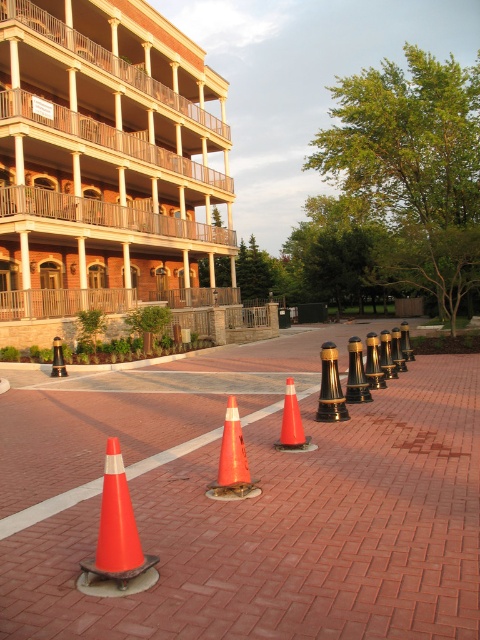
You are standing at the point with coordinates (48, 508) in the image. What object are you standing on?

You are standing on the orange reflective cone at center because the point (48, 508) is located on it.